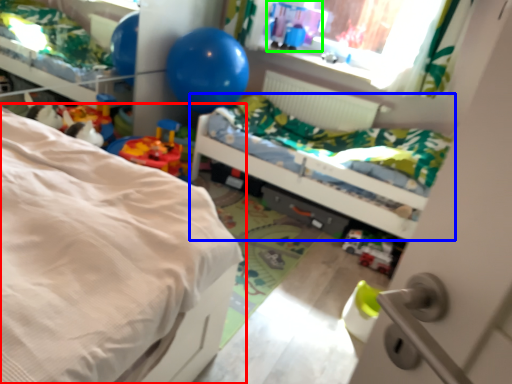
Question: Considering the real-world distances, which object is closest to bed (highlighted by a red box)? bed (highlighted by a blue box) or toy (highlighted by a green box).

Choices:
 (A) bed
 (B) toy

Answer: (A)